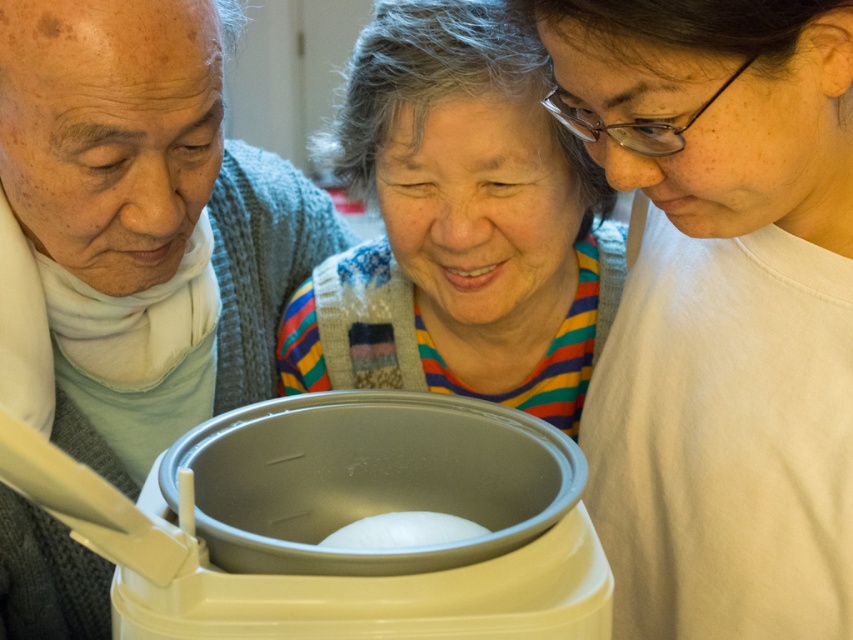
In the scene described, where is the striped sweater at center located relative to the white matte ball at center?

The striped sweater at center is to the right of the white matte ball at center.

You are trying to decide which sweater to wear for a casual day out. Both the matte gray sweater at left and the striped sweater at center are options. Based on their sizes, which one would you choose if you prefer a looser, more comfortable fit?

A: The matte gray sweater at left is bigger than the striped sweater at center, so you should choose the matte gray sweater at left for a looser, more comfortable fit.

You are standing in a kitchen and see two sweaters. The first is a matte gray sweater at left, and the second is a striped sweater at center. Which one is positioned further to the left?

The matte gray sweater at left is positioned further to the left than the striped sweater at center.